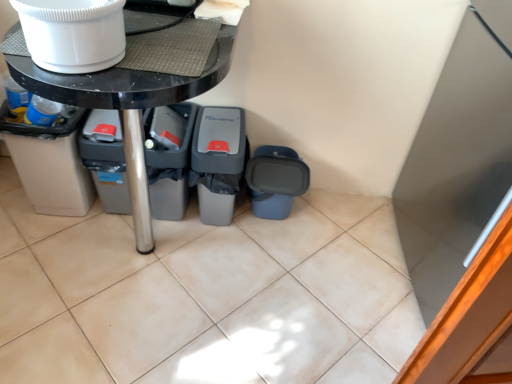
This screenshot has width=512, height=384. Identify the location of free space between black glossy table at center and blue matte recycling bin at lower right, which is the 4th recycling bin in left-to-right order. (245, 262).